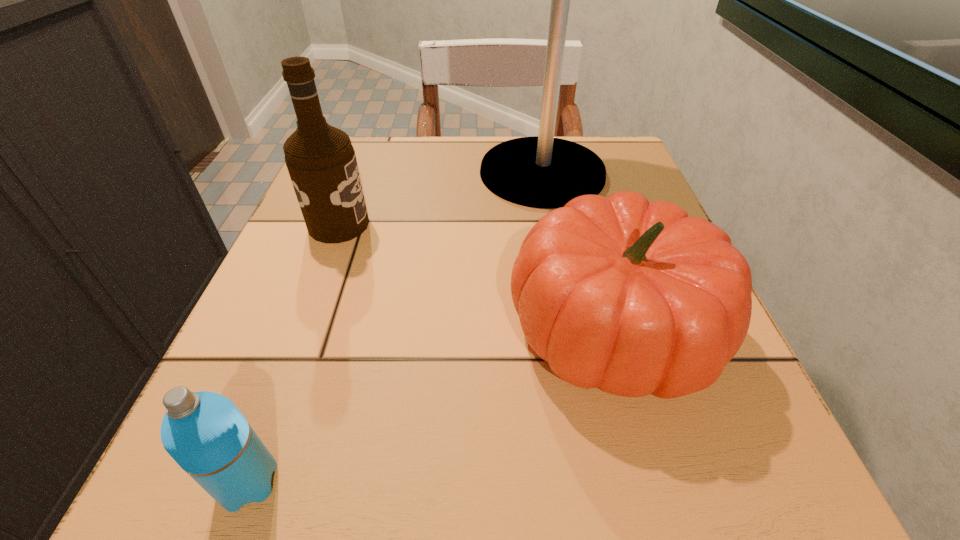
The height and width of the screenshot is (540, 960). I want to click on the tallest object, so click(x=544, y=172).

Find the location of a particular element. alcohol is located at coordinates (321, 161).

This screenshot has height=540, width=960. I want to click on the second nearest object, so click(x=633, y=297).

Locate an element on the screen. This screenshot has height=540, width=960. thermos bottle is located at coordinates (204, 432).

The height and width of the screenshot is (540, 960). I want to click on free region located 0.210m on the front of the tallest object, so click(x=564, y=289).

The image size is (960, 540). Find the location of `free space located on the label of the third shortest object`. free space located on the label of the third shortest object is located at coordinates (540, 225).

Locate an element on the screen. vacant position located on the left of the second nearest object is located at coordinates (437, 330).

Where is `vacant space located on the back of the thermos bottle`? vacant space located on the back of the thermos bottle is located at coordinates coord(327,266).

Find the location of `object present at the far edge`. object present at the far edge is located at coordinates (544, 172).

You are a GUI agent. You are given a task and a screenshot of the screen. Output one action in this format:
    pyautogui.click(x=<x>, y=<y>)
    Task: Click on the object at the near edge
    The height and width of the screenshot is (540, 960).
    Given the screenshot: What is the action you would take?
    pyautogui.click(x=204, y=432)